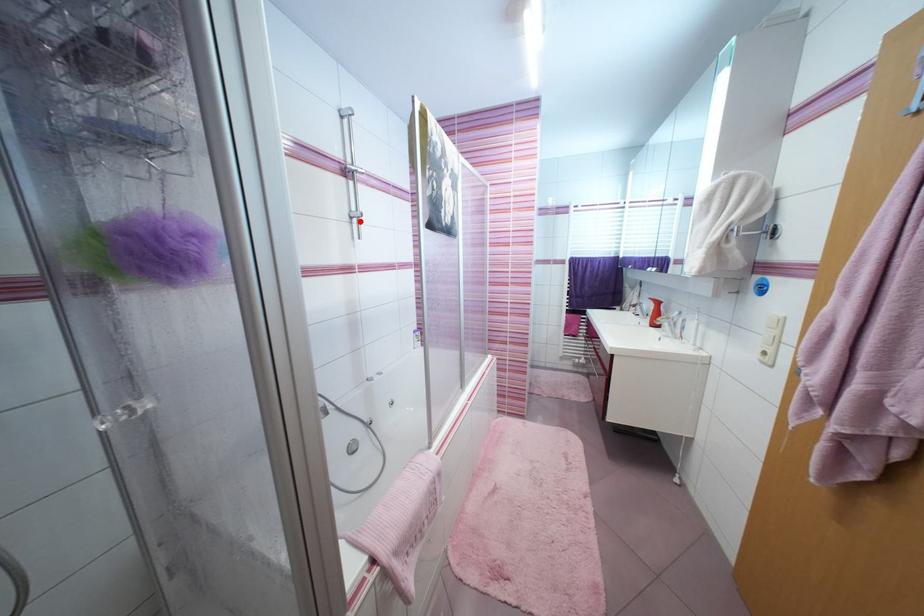
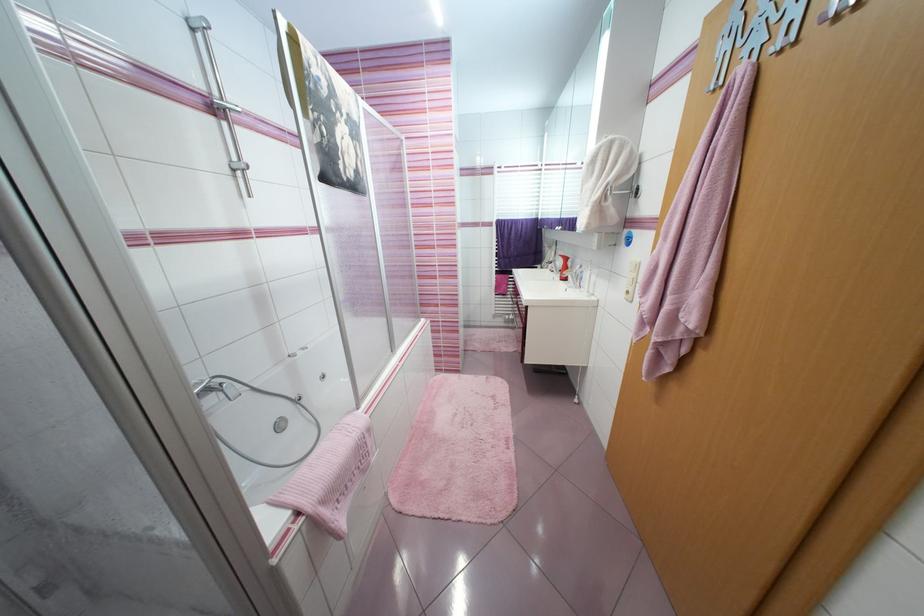
In the second image, find the point that corresponds to the highlighted location in the first image.

(245, 175)